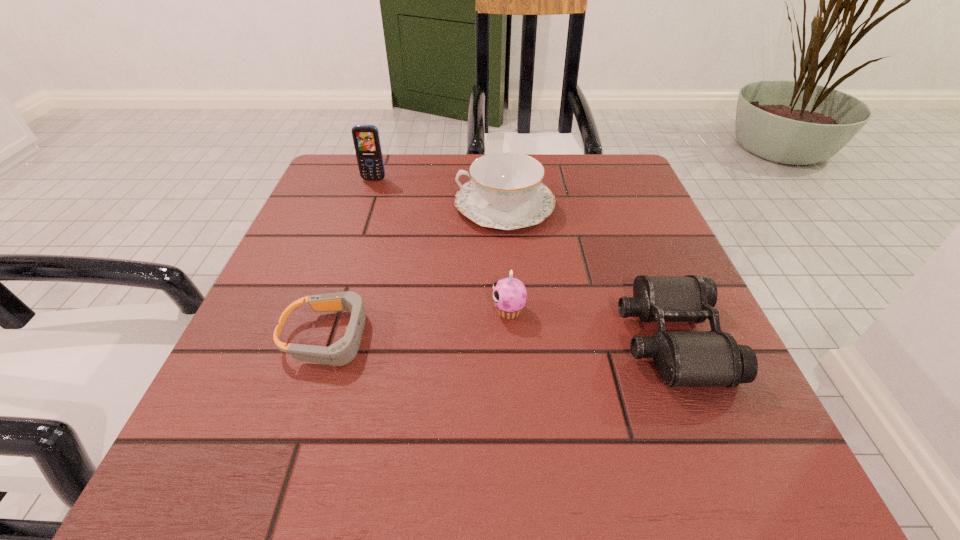
Select which object is the second closest to the chinaware. Please provide its 2D coordinates. Your answer should be formatted as a tuple, i.e. [(x, y)], where the tuple contains the x and y coordinates of a point satisfying the conditions above.

[(683, 358)]

Locate an element on the screen. This screenshot has width=960, height=540. object that is the third nearest to the cupcake is located at coordinates (342, 352).